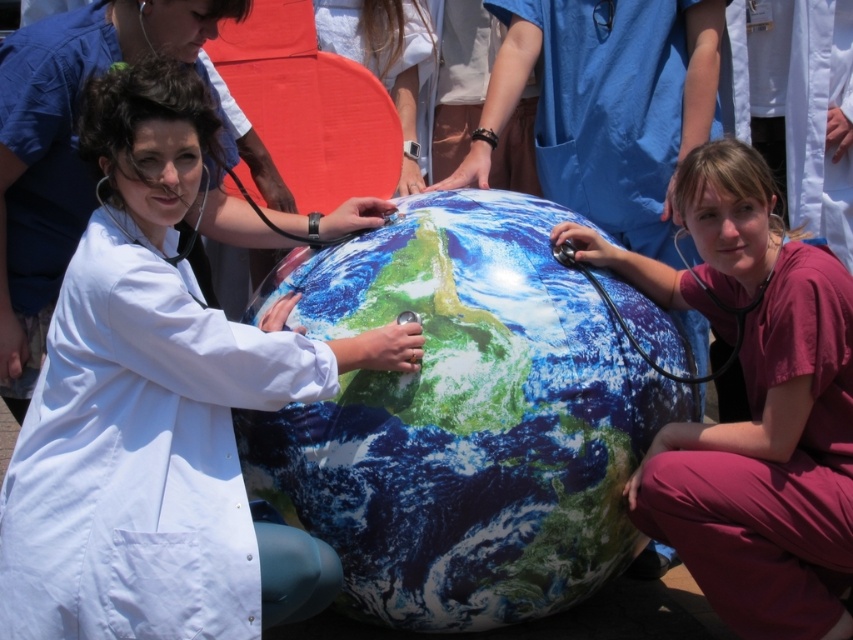
Question: Does matte white coat at center have a smaller size compared to black rubber stethoscope at left?

Choices:
 (A) no
 (B) yes

Answer: (A)

Question: Does matte pink scrubs at lower right appear over black rubber stethoscope at left?

Choices:
 (A) no
 (B) yes

Answer: (A)

Question: Among these objects, which one is farthest from the camera?

Choices:
 (A) matte pink scrubs at lower right
 (B) earth-like globe at center
 (C) black rubber stethoscope at left

Answer: (C)

Question: Among these objects, which one is nearest to the camera?

Choices:
 (A) black rubber stethoscope at left
 (B) matte white coat at center
 (C) white lab coat at left

Answer: (C)

Question: Which object is closer to the camera taking this photo?

Choices:
 (A) black rubber stethoscope at left
 (B) matte pink scrubs at lower right

Answer: (B)

Question: Is the position of earth-like globe at center less distant than that of matte white coat at center?

Choices:
 (A) yes
 (B) no

Answer: (A)